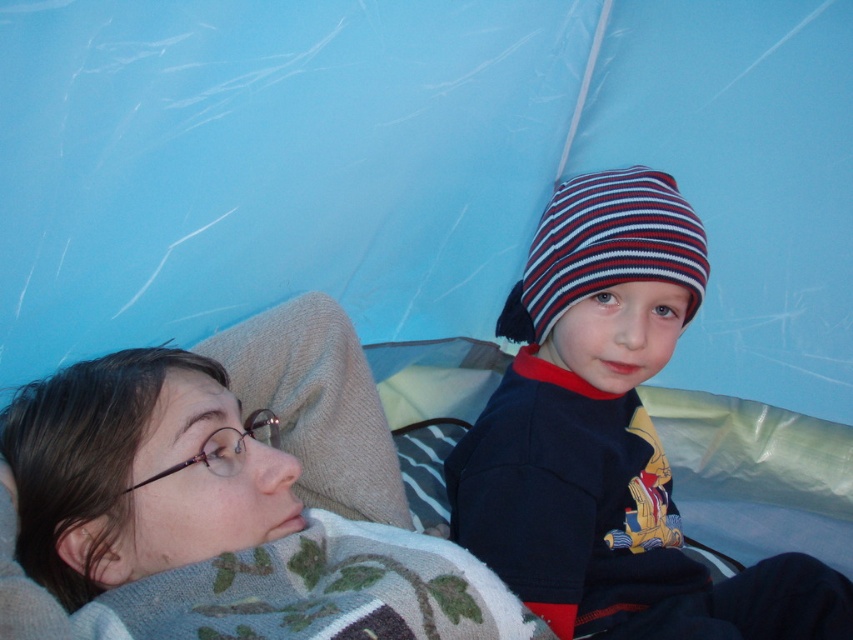
You are standing outside the tent and looking through the entrance. There are two points marked inside the tent at coordinates point (641,332) and point (619,225). Which point is closer to you?

Point (641,332) is closer to the camera than point (619,225).

You are planning to hang a small picture frame on the wall inside the blue fabric tent at upper center. Considering the height of the striped knit beanie at center, will the picture frame be placed above or below the beanie?

The blue fabric tent at upper center is taller than the striped knit beanie at center, so the picture frame can be placed above the beanie.

You are a photographer inside the tent and want to take a photo of the blue fabric tent at upper center and the striped knit hat at upper right. Which object should you focus on first to ensure both are in focus?

You should focus on the blue fabric tent at upper center first because it is closer to you than the striped knit hat at upper right, so focusing on the closer object first will help ensure both are in focus.